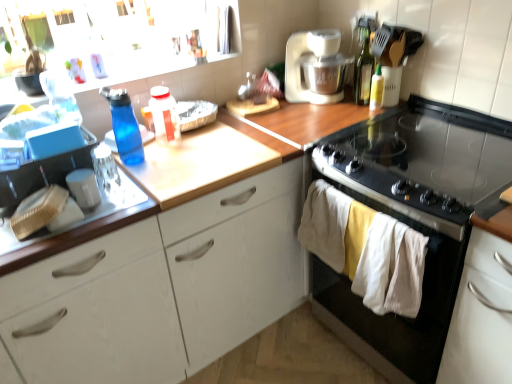
Locate an element on the screen. The image size is (512, 384). empty space that is in between white plastic mixer at upper right and green glass bottle at upper right, arranged as the 2th bottle when viewed from the right is located at coordinates (347, 109).